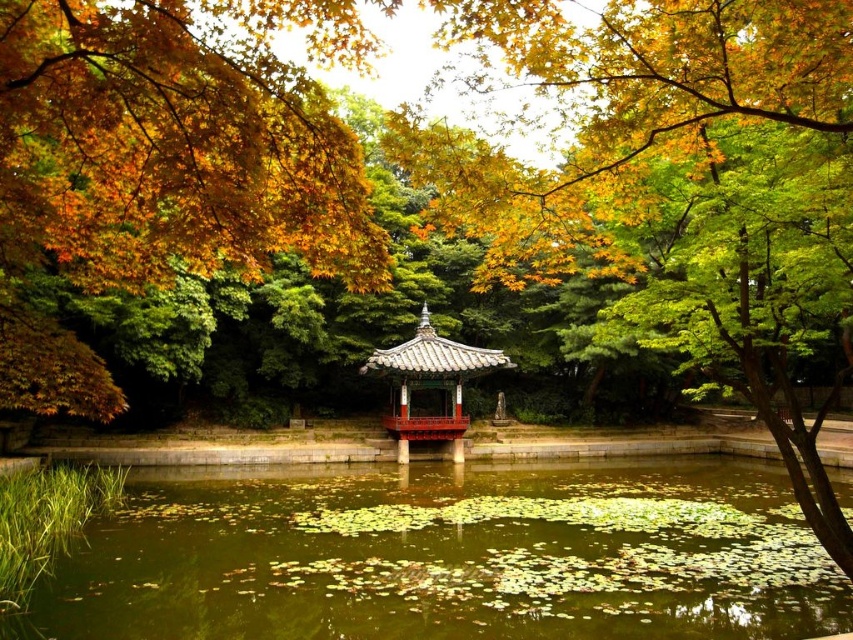
Who is more distant from viewer, (720, 556) or (502, 358)?

Positioned behind is point (502, 358).

Who is higher up, green mossy water at center or matte black gazebo at center?

matte black gazebo at center

Between point (393, 547) and point (479, 362), which one is positioned in front?

Point (393, 547) is more forward.

You are a GUI agent. You are given a task and a screenshot of the screen. Output one action in this format:
    pyautogui.click(x=<x>, y=<y>)
    Task: Click on the green mossy water at center
    This screenshot has height=640, width=853.
    Given the screenshot: What is the action you would take?
    pyautogui.click(x=450, y=556)